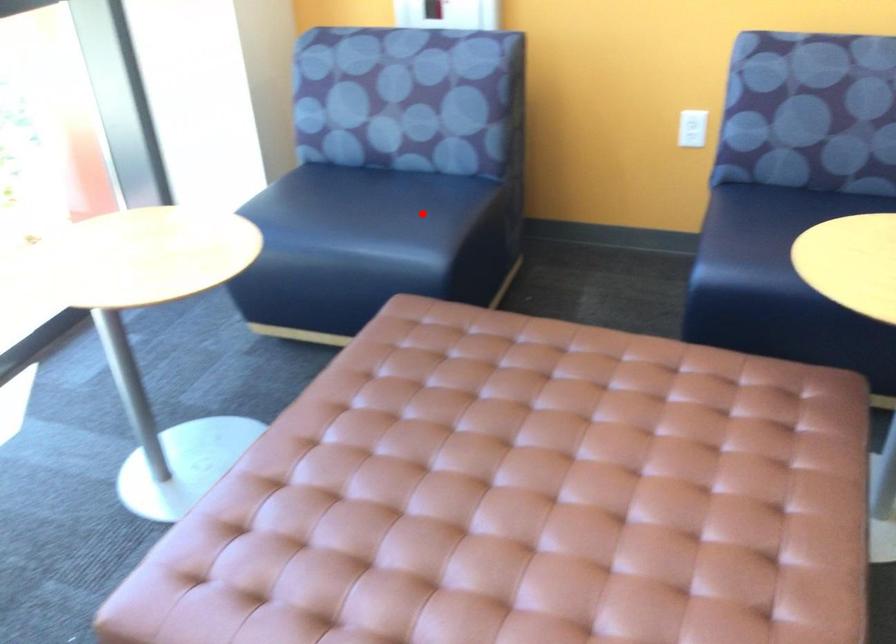
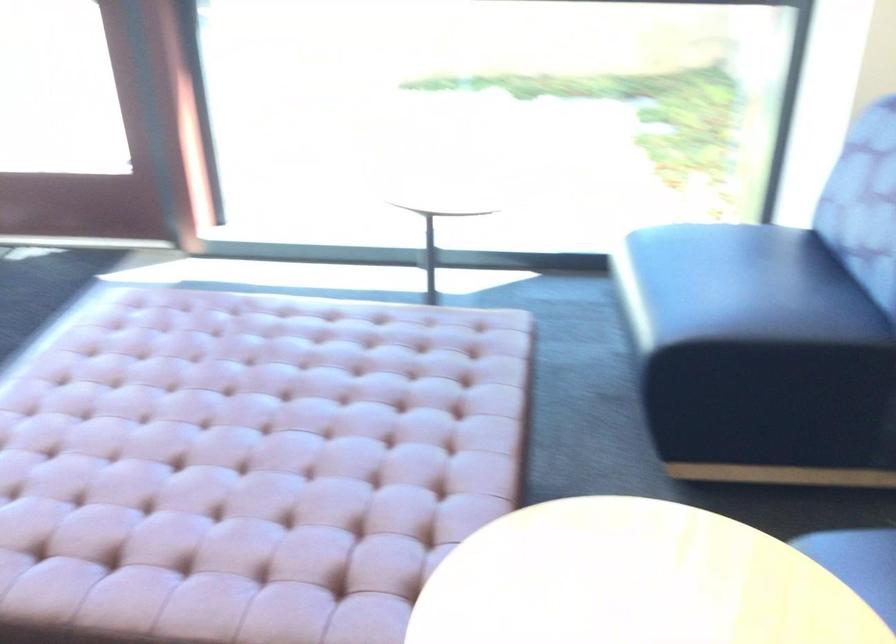
The point at the highlighted location is marked in the first image. Where is the corresponding point in the second image?

(724, 301)